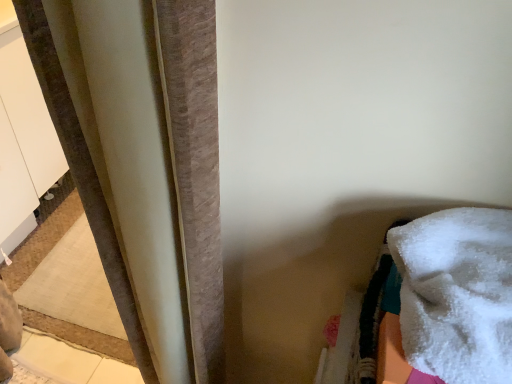
Describe the element at coordinates (457, 294) in the screenshot. The height and width of the screenshot is (384, 512). I see `white fluffy towel at lower right` at that location.

Identify the location of white fluffy towel at lower right. The image size is (512, 384). (457, 294).

Image resolution: width=512 pixels, height=384 pixels. Identify the location of white fluffy towel at lower right. (457, 294).